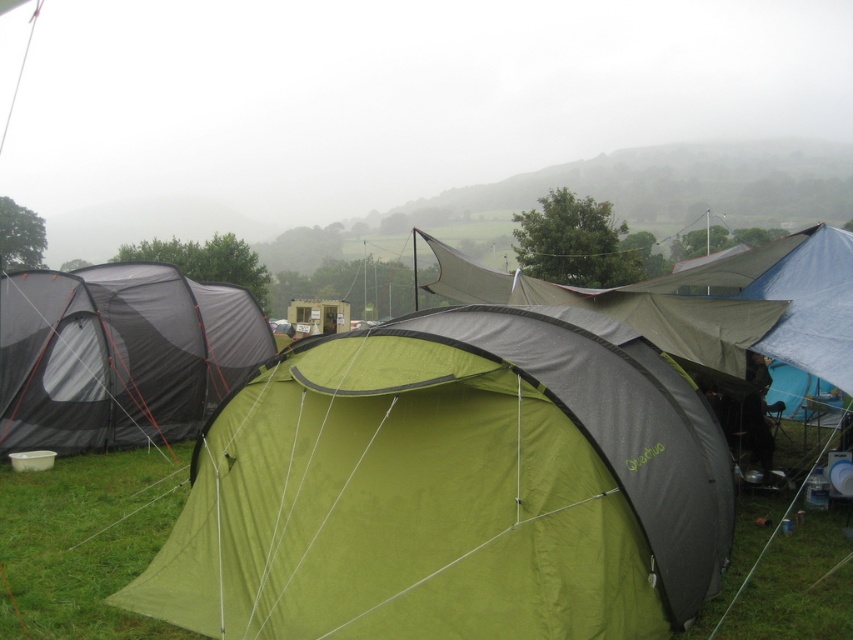
Question: Which of the following is the farthest from the observer?

Choices:
 (A) green fabric tent at center
 (B) black mesh tent at left

Answer: (B)

Question: Can you confirm if green fabric tent at center is smaller than green fabric canopy at center?

Choices:
 (A) no
 (B) yes

Answer: (B)

Question: Is green fabric tent at center further to the viewer compared to black mesh tent at left?

Choices:
 (A) yes
 (B) no

Answer: (B)

Question: Which object is the closest to the green fabric canopy at center?

Choices:
 (A) green fabric tent at center
 (B) black mesh tent at left

Answer: (A)

Question: Which point is closer to the camera?

Choices:
 (A) (25, 364)
 (B) (524, 518)
 (C) (717, 330)

Answer: (B)

Question: Does black mesh tent at left appear over green fabric canopy at center?

Choices:
 (A) yes
 (B) no

Answer: (B)